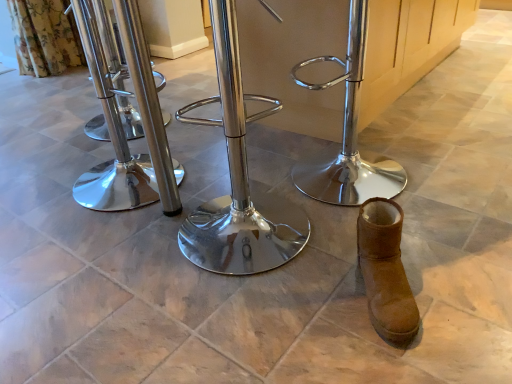
The image size is (512, 384). I want to click on empty space that is to the right of polished metal swivel chair at center, which appears as the 3th swivel chair when viewed from the left, so click(445, 170).